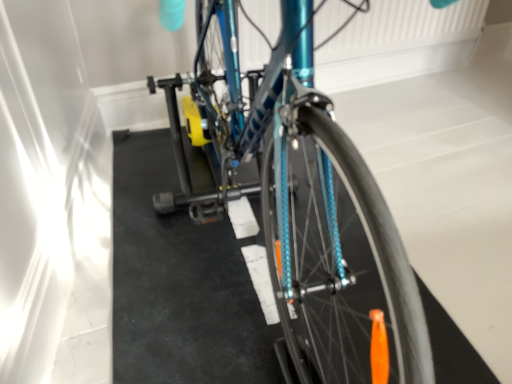
What is the approximate width of teal metallic bicycle at center?

5.75 feet.

What do you see at coordinates (304, 205) in the screenshot?
I see `teal metallic bicycle at center` at bounding box center [304, 205].

In order to click on teal metallic bicycle at center in this screenshot , I will do `click(304, 205)`.

Locate an element on the screen. teal metallic bicycle at center is located at coordinates (304, 205).